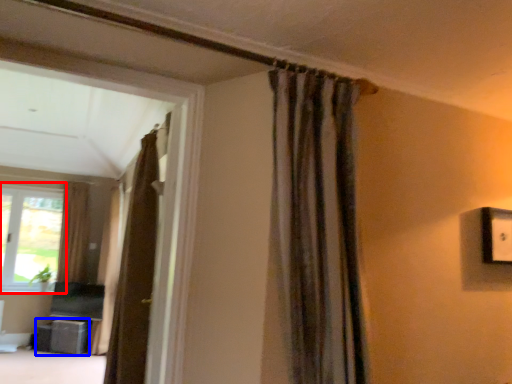
Question: Which object appears closest to the camera in this image, window (highlighted by a red box) or furniture (highlighted by a blue box)?

Choices:
 (A) window
 (B) furniture

Answer: (B)